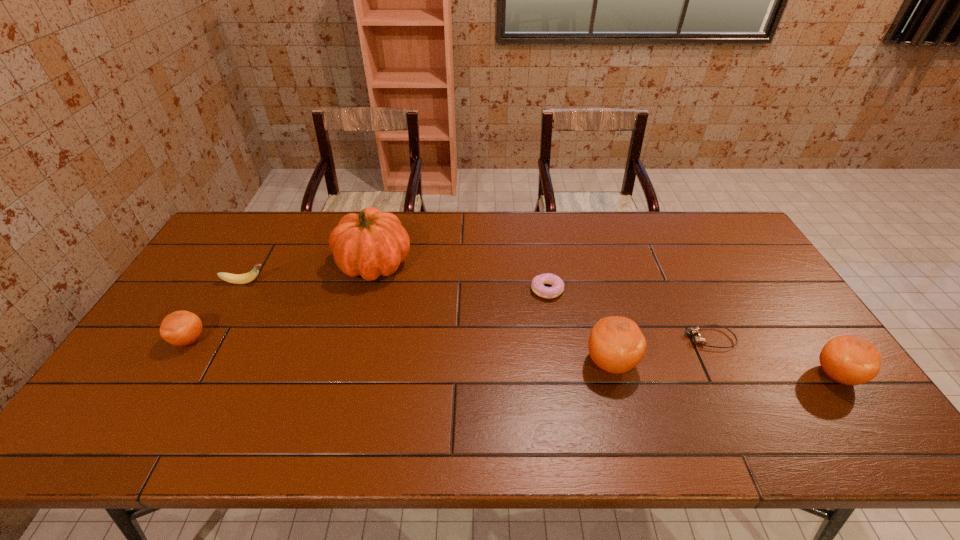
Identify the location of vacant space at the right edge of the desktop. (794, 353).

The width and height of the screenshot is (960, 540). Identify the location of free region at the near left corner of the desktop. (159, 394).

Where is `free region at the far right corner of the desktop`? The height and width of the screenshot is (540, 960). free region at the far right corner of the desktop is located at coordinates (735, 238).

Identify the location of free space between the banana and the leftmost orange. (217, 311).

Where is `empty space that is in between the shortest object and the tallest object`? Image resolution: width=960 pixels, height=540 pixels. empty space that is in between the shortest object and the tallest object is located at coordinates (542, 301).

You are a GUI agent. You are given a task and a screenshot of the screen. Output one action in this format:
    pyautogui.click(x=<x>, y=<y>)
    Task: Click on the free space between the banana and the pumpkin
    Image resolution: width=960 pixels, height=540 pixels.
    Given the screenshot: What is the action you would take?
    pyautogui.click(x=310, y=273)

Where is `vacant space in between the doughnut and the fifth object from right to left`? The width and height of the screenshot is (960, 540). vacant space in between the doughnut and the fifth object from right to left is located at coordinates (461, 276).

The image size is (960, 540). I want to click on vacant point located between the second tallest object and the banana, so click(x=428, y=322).

This screenshot has width=960, height=540. I want to click on free space between the rightmost object and the shortest object, so click(773, 357).

You are a GUI agent. You are given a task and a screenshot of the screen. Output one action in this format:
    pyautogui.click(x=<x>, y=<y>)
    Task: Click on the free point between the fifth object from left to right and the leftmost orange
    The image size is (960, 540).
    Given the screenshot: What is the action you would take?
    pyautogui.click(x=400, y=352)